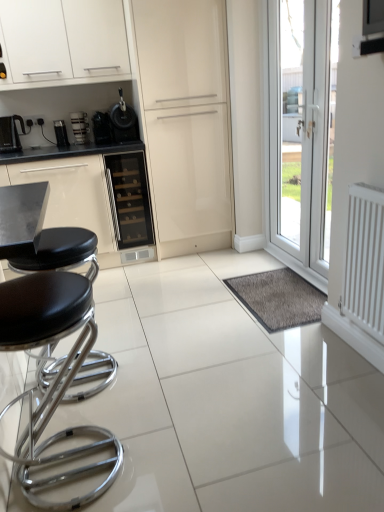
Question: From a real-world perspective, is satin black coffee machine at center, which is the 1th coffee machine in right-to-left order, above or below transparent glass door at right?

Choices:
 (A) below
 (B) above

Answer: (B)

Question: Would you say satin black coffee machine at center, acting as the 2th coffee machine starting from the left, is inside or outside transparent glass door at right?

Choices:
 (A) inside
 (B) outside

Answer: (B)

Question: Considering the real-world distances, which object is farthest from the glossy cream cabinet at center?

Choices:
 (A) matte black coffee maker at left, the first appliance viewed from the left
 (B) satin black coffee machine at center, which is the 1th coffee machine in right-to-left order
 (C) matte black coffee machine at left, the second coffee machine from the right
 (D) white glossy cabinet at upper left
 (E) black glass wine cooler at center

Answer: (C)

Question: Which object is the farthest from the black leather stool at left, the second stool from the back?

Choices:
 (A) glossy cream cabinet at center
 (B) black matte coffee maker at center, which is the 1th appliance from right to left
 (C) white matte radiator at right
 (D) matte black coffee maker at left, the first appliance viewed from the left
 (E) transparent glass door at right

Answer: (D)